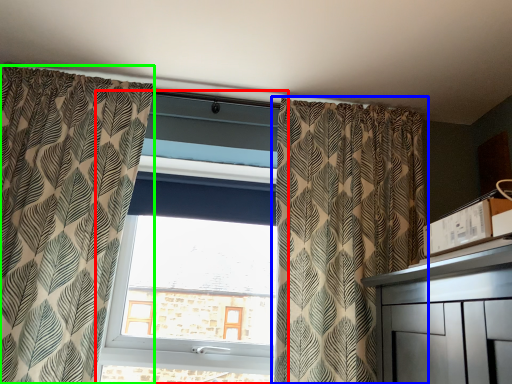
Question: Which object is positioned closest to window (highlighted by a red box)? Select from curtain (highlighted by a blue box) and curtain (highlighted by a green box).

Choices:
 (A) curtain
 (B) curtain

Answer: (B)